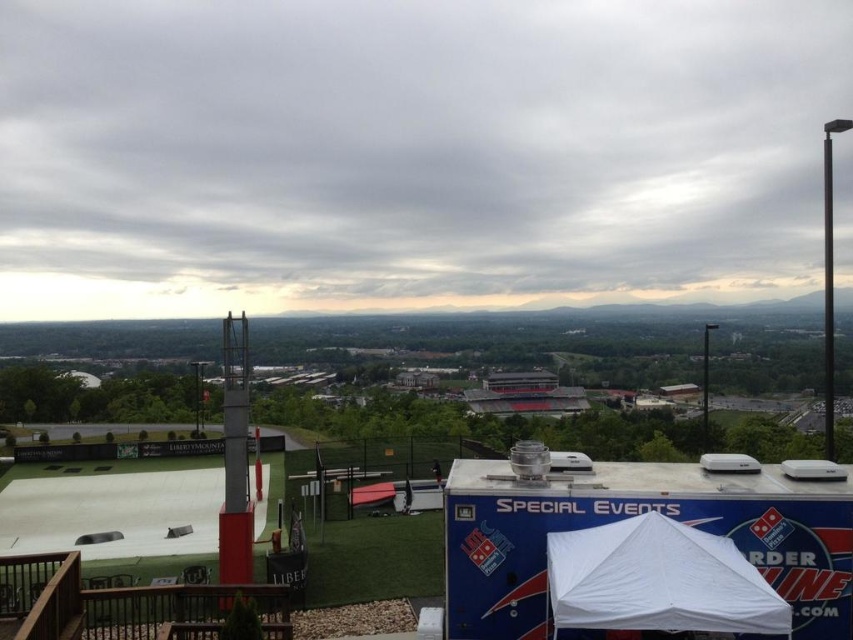
Question: Is red brick stadium at center thinner than white fabric canopy at lower right?

Choices:
 (A) no
 (B) yes

Answer: (A)

Question: Which point is closer to the camera?

Choices:
 (A) red brick stadium at center
 (B) white fabric canopy at lower right

Answer: (B)

Question: In this image, where is red brick stadium at center located relative to white fabric canopy at lower right?

Choices:
 (A) below
 (B) above

Answer: (A)

Question: Which point is farther to the camera?

Choices:
 (A) white fabric canopy at lower right
 (B) red brick stadium at center

Answer: (B)

Question: Does red brick stadium at center have a larger size compared to white fabric canopy at lower right?

Choices:
 (A) no
 (B) yes

Answer: (B)